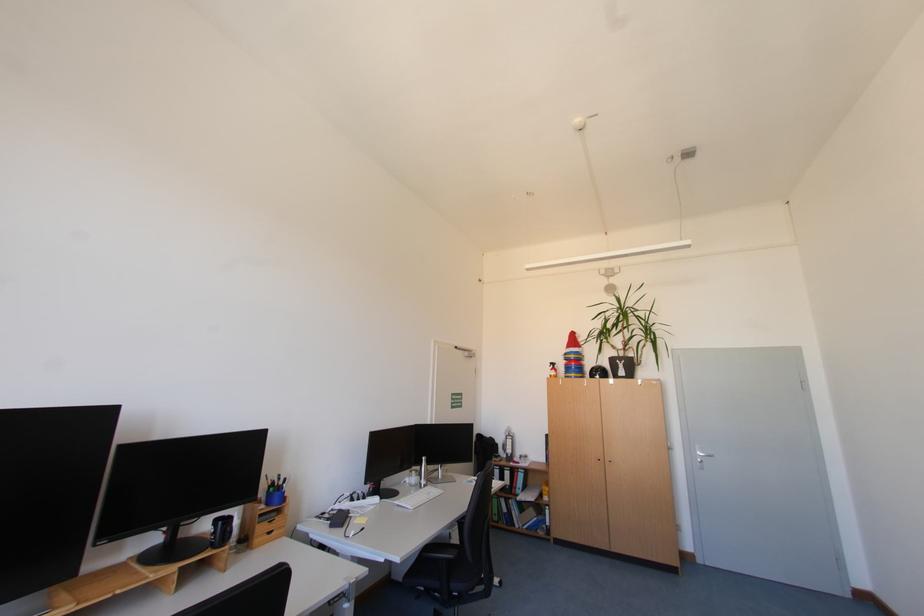
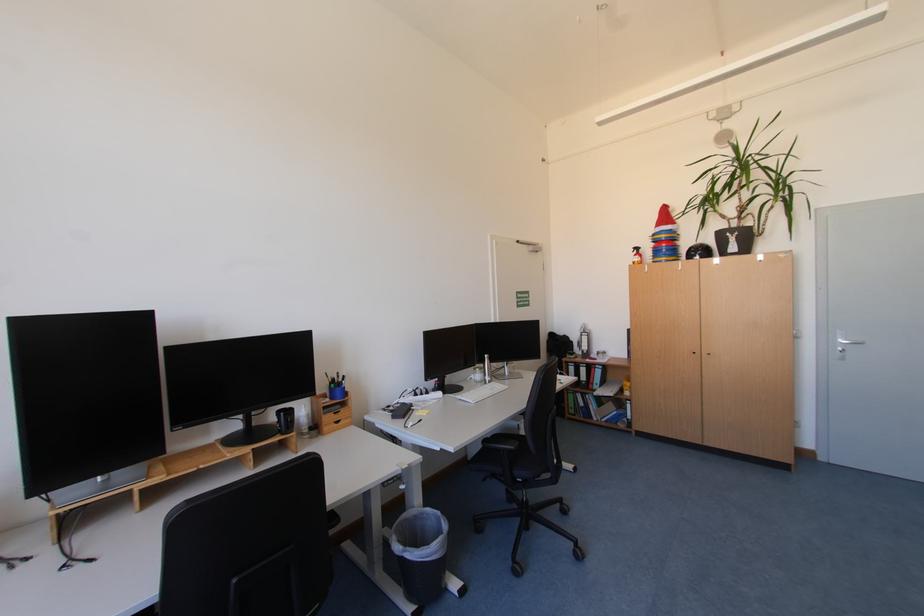
Find the pixel in the second image that matches (x=581, y=369) in the first image.

(672, 252)